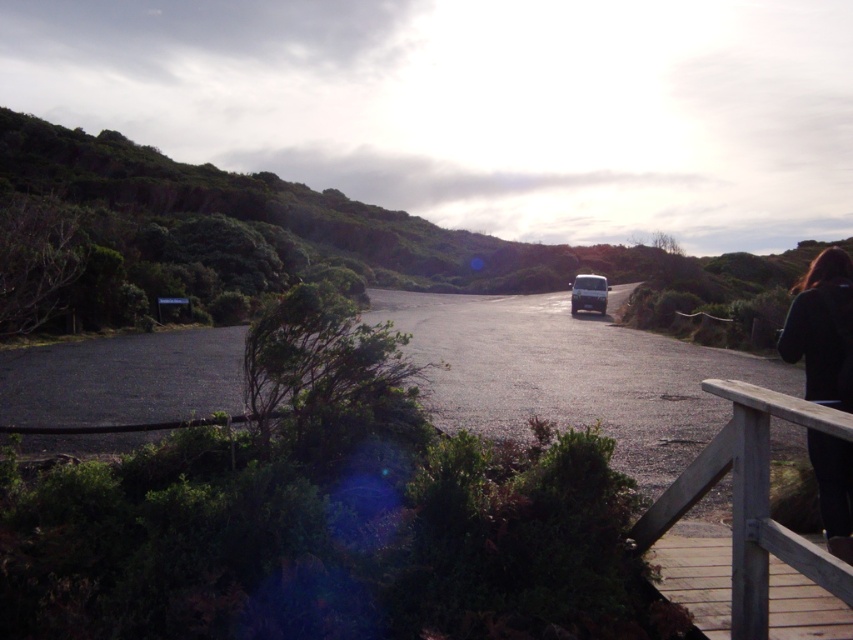
Question: Does black fabric at lower right appear on the right side of white matte suv at center?

Choices:
 (A) yes
 (B) no

Answer: (B)

Question: Estimate the real-world distances between objects in this image. Which object is closer to the black fabric at lower right?

Choices:
 (A) wooden at right
 (B) white matte suv at center

Answer: (A)

Question: Can you confirm if wooden at right is smaller than white matte suv at center?

Choices:
 (A) yes
 (B) no

Answer: (A)

Question: Can you confirm if wooden at right is wider than black fabric at lower right?

Choices:
 (A) no
 (B) yes

Answer: (A)

Question: Which point is closer to the camera taking this photo?

Choices:
 (A) (758, 552)
 (B) (785, 348)
 (C) (585, 288)

Answer: (A)

Question: Which point appears closest to the camera in this image?

Choices:
 (A) (848, 509)
 (B) (776, 394)
 (C) (582, 284)

Answer: (A)